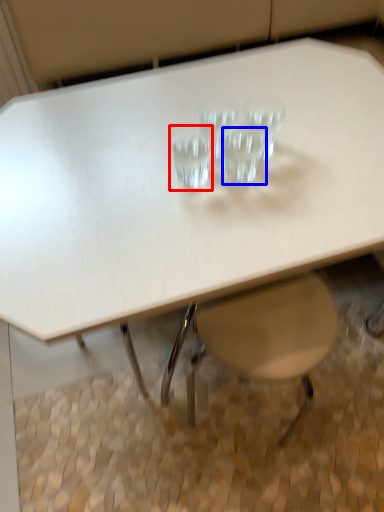
Question: Which object is further to the camera taking this photo, martini glass (highlighted by a red box) or martini glass (highlighted by a blue box)?

Choices:
 (A) martini glass
 (B) martini glass

Answer: (B)